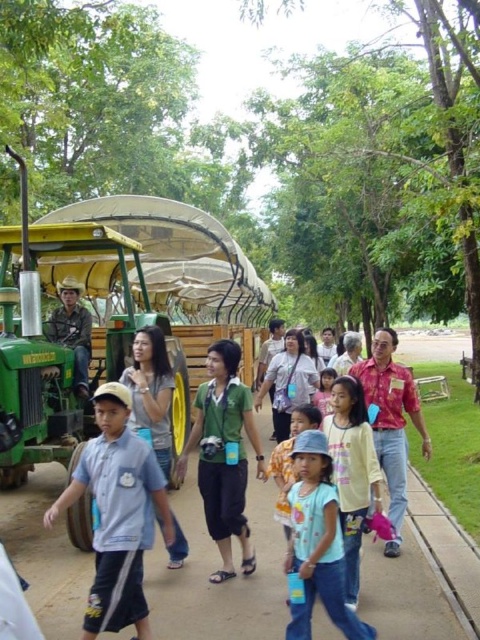
Question: Which object appears farthest from the camera in this image?

Choices:
 (A) light blue cotton shirt at lower left
 (B) green matte shirt at center

Answer: (B)

Question: Which is farther from the gray concrete pavement at center?

Choices:
 (A) green matte shirt at center
 (B) blue cotton shirt at center
 (C) light blue cotton shirt at lower left
 (D) light blue denim jeans at center

Answer: (D)

Question: Is green matte shirt at center to the right of rustic wood chair at center from the viewer's perspective?

Choices:
 (A) yes
 (B) no

Answer: (A)

Question: Can you confirm if gray concrete pavement at center is smaller than blue cotton shirt at center?

Choices:
 (A) yes
 (B) no

Answer: (A)

Question: Can you confirm if gray concrete pavement at center is positioned to the right of green matte shirt at center?

Choices:
 (A) yes
 (B) no

Answer: (B)

Question: Among these objects, which one is farthest from the camera?

Choices:
 (A) gray concrete pavement at center
 (B) rustic wood chair at center
 (C) light blue denim jeans at center

Answer: (B)